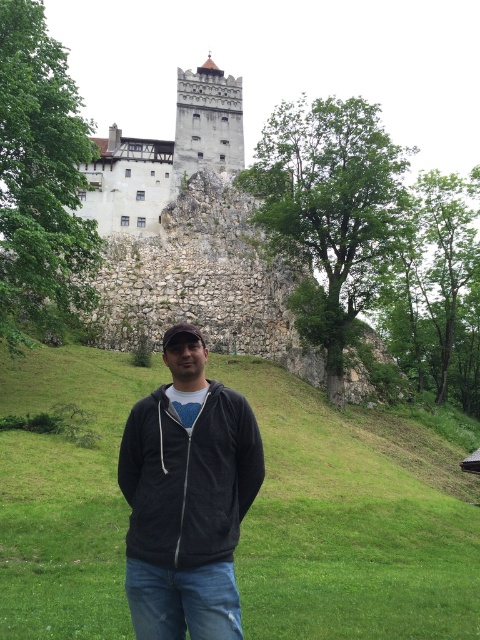
Question: In this image, where is green grass at center located relative to white stone tower at upper center?

Choices:
 (A) right
 (B) left

Answer: (A)

Question: Among these objects, which one is farthest from the camera?

Choices:
 (A) white stone tower at upper center
 (B) dark gray hoodie at center
 (C) green grass at center
 (D) white stone castle at upper center

Answer: (A)

Question: Among these objects, which one is nearest to the camera?

Choices:
 (A) white stone castle at upper center
 (B) dark gray hoodie at center

Answer: (B)

Question: Can you confirm if white stone castle at upper center is bigger than white stone tower at upper center?

Choices:
 (A) no
 (B) yes

Answer: (B)

Question: Observing the image, what is the correct spatial positioning of green grass at center in reference to dark gray hoodie at center?

Choices:
 (A) right
 (B) left

Answer: (A)

Question: Which point is closer to the camera?

Choices:
 (A) (184, 144)
 (B) (397, 563)
 (C) (136, 528)
 (D) (186, 172)

Answer: (C)